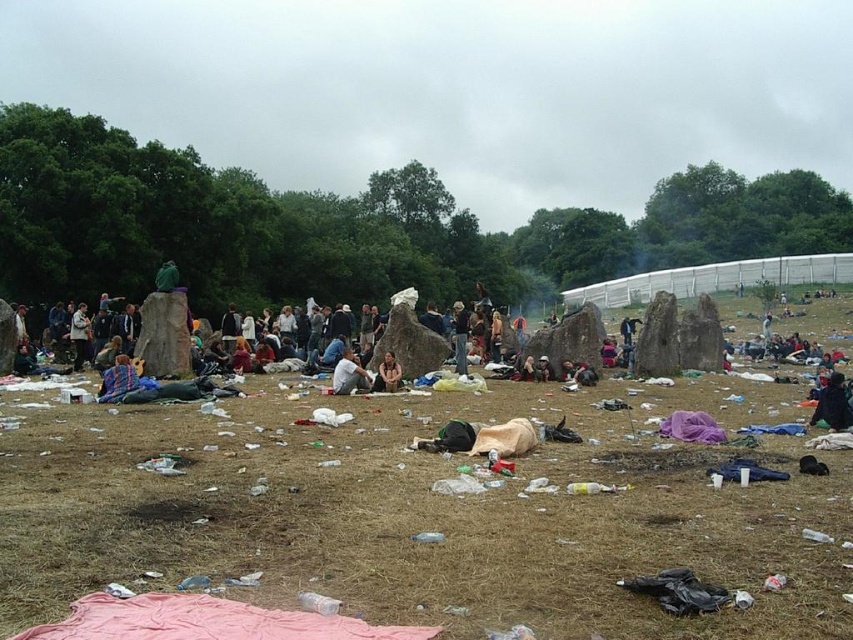
You are at a music festival and want to sit down. There is brown dry grass at center and light brown fabric at center in front of you. Which one is closer to you?

The brown dry grass at center is closer to you because it is in front of the light brown fabric at center.

You are a festival attendee carrying a 10 meter long banner that needs to be displayed between the blue fabric at center and the light brown fabric at center. Can the banner fit the space between them?

The blue fabric at center and light brown fabric at center are 14.28 meters apart, so the 10 meter long banner can fit between them with 4.28 meters of extra space remaining.